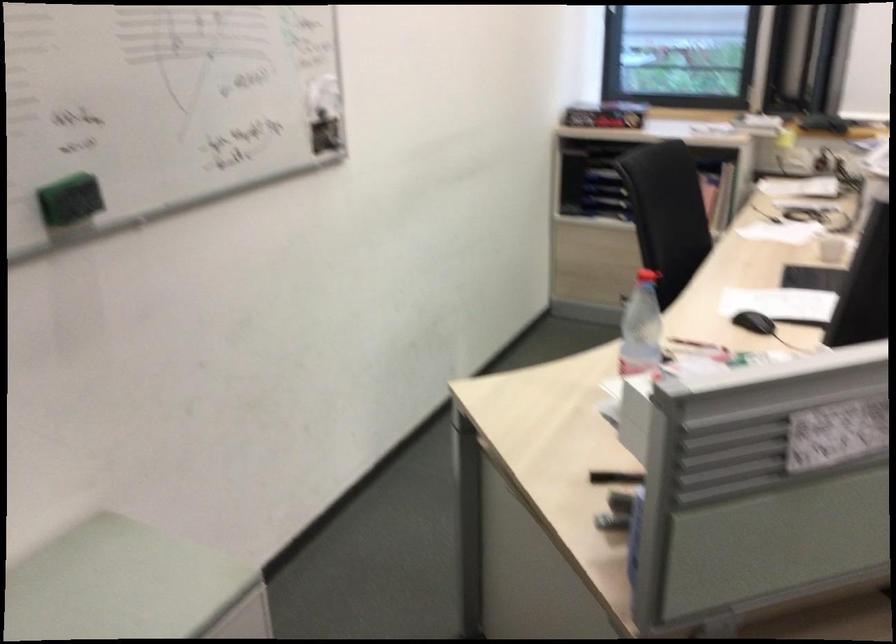
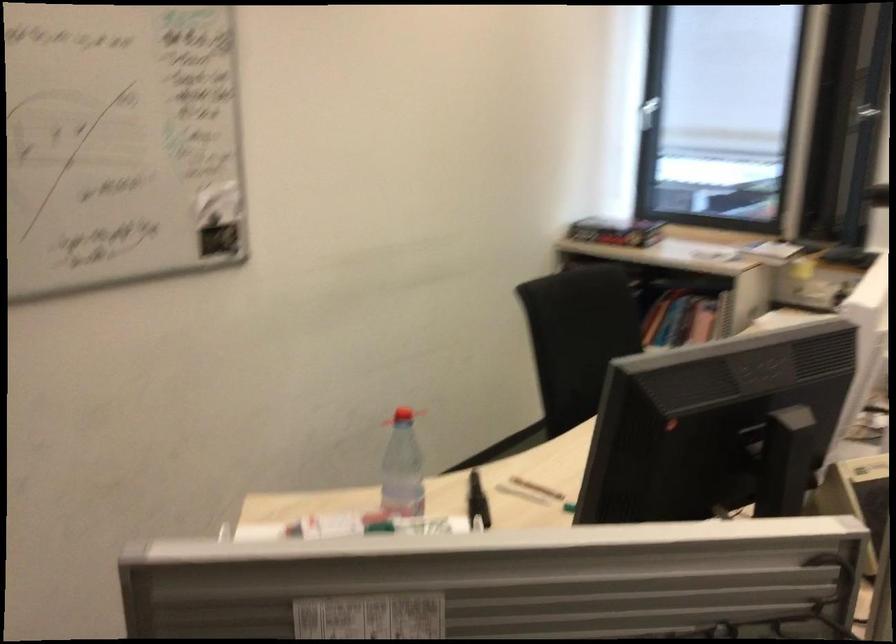
Question: I am providing you with two images of the same scene from different viewpoints. After the viewpoint changes to image2, which objects are now occluded?

Choices:
 (A) plastic water bottle
 (B) black computer mouse
 (C) book in shelf
 (D) small paper packet

Answer: (B)